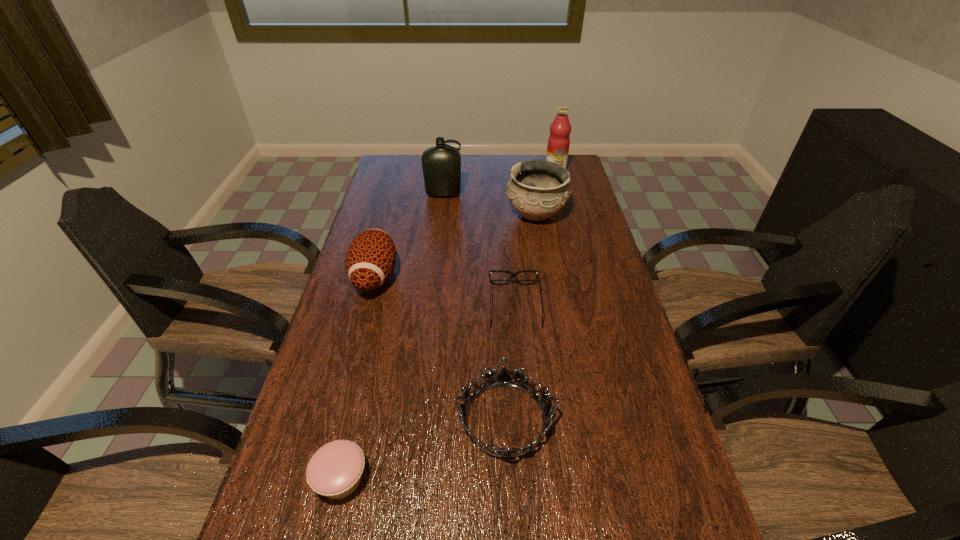
The height and width of the screenshot is (540, 960). In order to click on vacant space that's between the fifth object from right to left and the pottery in this screenshot , I will do `click(490, 204)`.

Locate an element on the screen. free space between the third object from left to right and the spectacles is located at coordinates (479, 250).

Where is `unoccupied area between the bottle and the fruit juice`? The width and height of the screenshot is (960, 540). unoccupied area between the bottle and the fruit juice is located at coordinates click(499, 182).

Image resolution: width=960 pixels, height=540 pixels. I want to click on vacant region between the fruit juice and the fourth tallest object, so click(x=466, y=223).

This screenshot has width=960, height=540. Identify the location of free space between the fifth object from right to left and the football. (409, 235).

In order to click on object identified as the third closest to the third object from left to right in this screenshot , I will do `click(559, 141)`.

Select which object appears as the second closest to the spectacles. Please provide its 2D coordinates. Your answer should be formatted as a tuple, i.e. [(x, y)], where the tuple contains the x and y coordinates of a point satisfying the conditions above.

[(537, 189)]

The width and height of the screenshot is (960, 540). Identify the location of free space in the image that satisfies the following two spatial constraints: 1. on the front side of the pottery; 2. on the front-facing side of the tiara. (569, 419).

You are a GUI agent. You are given a task and a screenshot of the screen. Output one action in this format:
    pyautogui.click(x=<x>, y=<y>)
    Task: Click on the vacant position in the image that satisfies the following two spatial constraints: 1. on the front-facing side of the tiara; 2. on the front side of the cupcake
    The width and height of the screenshot is (960, 540).
    Given the screenshot: What is the action you would take?
    pyautogui.click(x=508, y=479)